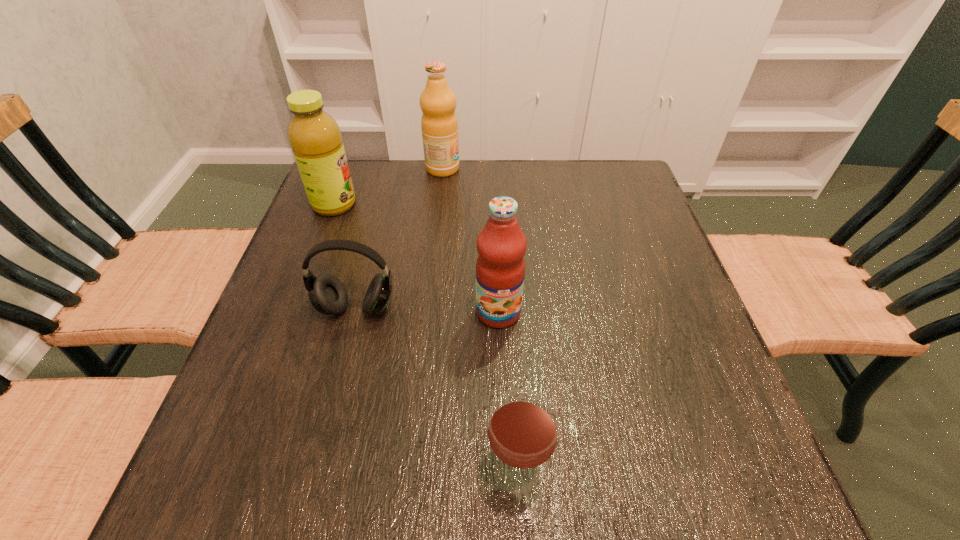
Find the location of a particular element. This screenshot has height=540, width=960. empty location between the farthest fruit juice and the wineglass is located at coordinates (480, 320).

Where is `unoccupied position between the headset and the wineglass`? The image size is (960, 540). unoccupied position between the headset and the wineglass is located at coordinates (437, 390).

In order to click on vacant space that's between the headset and the farthest object in this screenshot , I will do `click(399, 238)`.

What are the coordinates of `free spot between the second farthest fruit juice and the headset` in the screenshot? It's located at (x=346, y=256).

The height and width of the screenshot is (540, 960). Find the location of `empty location between the second farthest fruit juice and the rightmost fruit juice`. empty location between the second farthest fruit juice and the rightmost fruit juice is located at coordinates (417, 259).

Identify the location of vacant area between the farthest fruit juice and the headset. The height and width of the screenshot is (540, 960). (399, 238).

The image size is (960, 540). Identify the location of free space between the farthest fruit juice and the second farthest object. (389, 187).

At what (x,y) coordinates should I click in order to perform the action: click on vacant area between the nearest object and the second farthest object. Please return your answer as a coordinate pair (x, y). The height and width of the screenshot is (540, 960). Looking at the image, I should click on (425, 338).

The width and height of the screenshot is (960, 540). I want to click on free space between the headset and the second fruit juice from right to left, so click(x=399, y=238).

Identify the location of object that stands as the second closest to the farthest object. This screenshot has width=960, height=540. (327, 294).